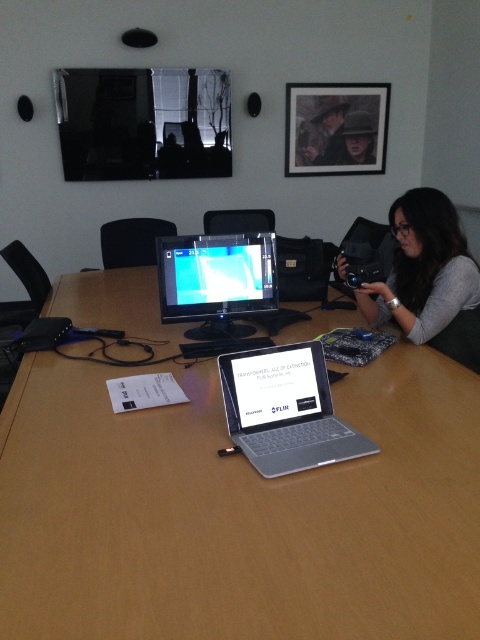
You are standing in the conference room and want to place a 5.5 meter long banner between you and the point at coordinates point (348, 157). Will the banner fit without overlapping anything?

The distance between you and point (348, 157) is 5.01 meters, so the 5.5 meter banner is longer than the available space. It will not fit without overlapping.

You are standing in the conference room and want to place a document on the wooden table at center. However, there is a matte black camera at right in your way. Can you reach the table without moving the camera?

The wooden table at center is closer to the viewer than the matte black camera at right, so you can reach the table without moving the camera because it is nearer to you.